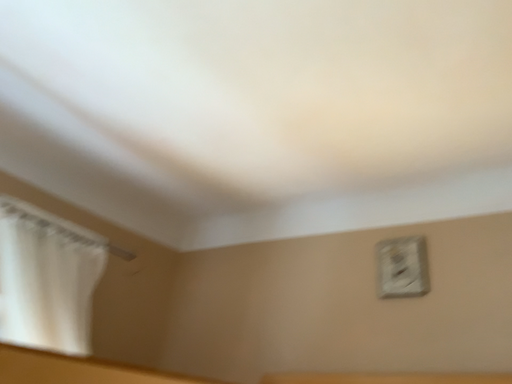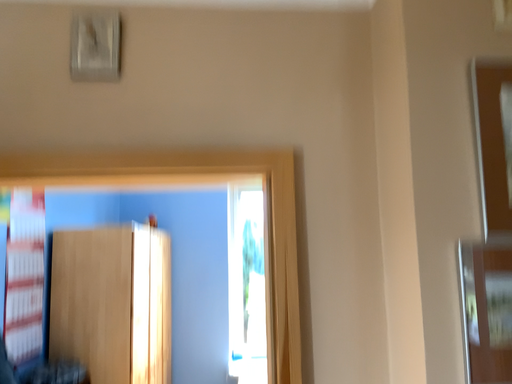
Question: How did the camera likely rotate when shooting the video?

Choices:
 (A) rotated right
 (B) rotated left

Answer: (A)